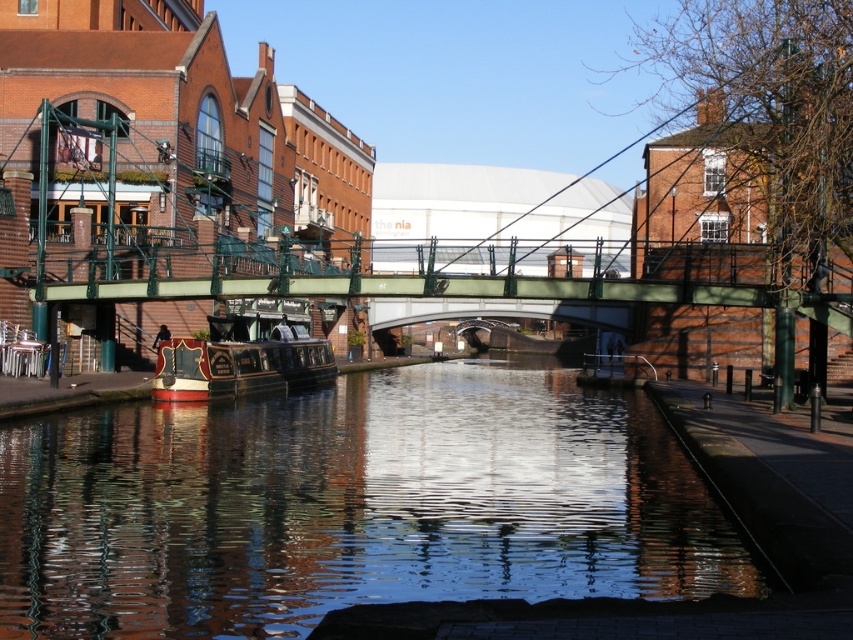
You are standing on the green pedestrian bridge and want to take a photo of the polished wood boat at left and the smooth reflective water at center. Which object is positioned to the right of the other?

The smooth reflective water at center is to the right of the polished wood boat at left.

You are standing on the green pedestrian bridge and want to take a photo of both the smooth reflective water at center and the polished wood boat at left. Can you fit both objects into your camera frame if your camera has a maximum field of view of 12 meters?

The smooth reflective water at center and polished wood boat at left are 11.32 meters apart. Since the distance between them is less than the camera field of view of 12 meters, both objects can be captured in a single frame.

Consider the image. You are standing on the green pedestrian bridge spanning the canal and notice a point marked at coordinates (351,504). Based on the scene described, what does this point most likely represent?

The point at coordinates (351,504) corresponds to smooth reflective water at center.